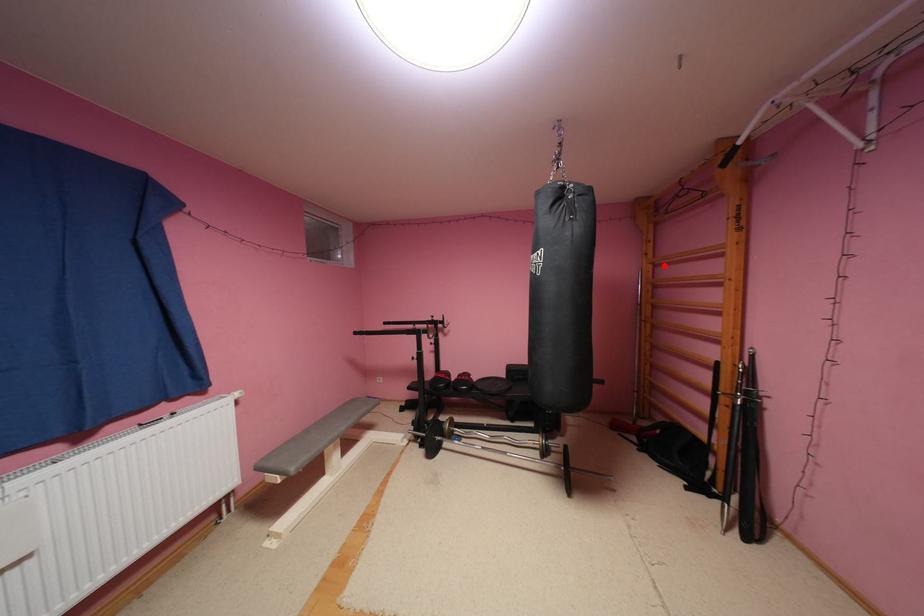
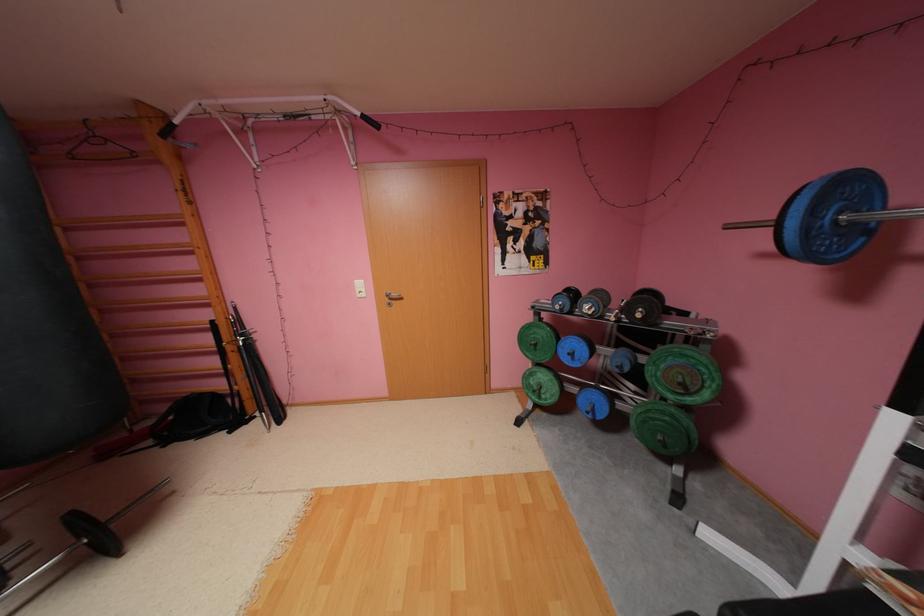
The point at the highlighted location is marked in the first image. Where is the corresponding point in the second image?

(76, 229)